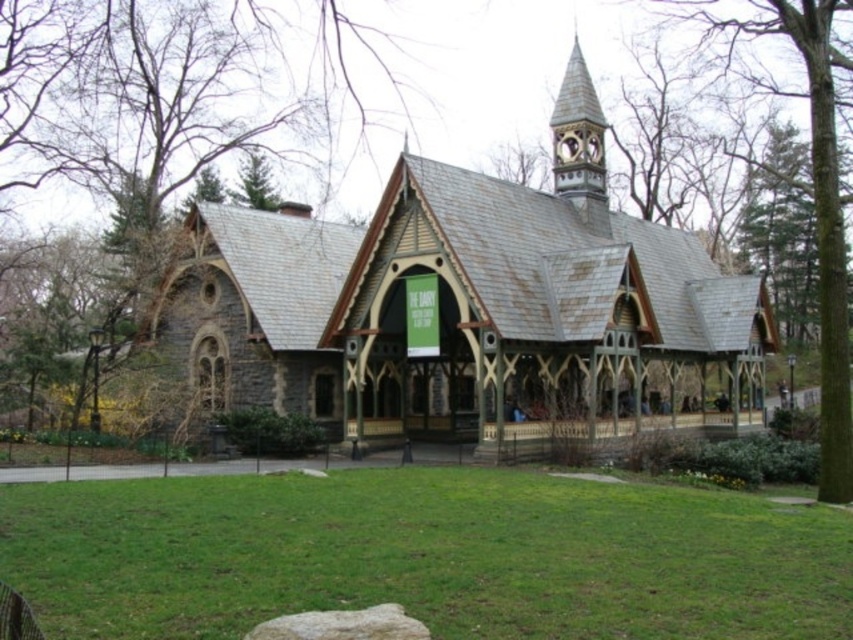
Question: Can you confirm if green grass at center is bigger than green leafy tree at upper left?

Choices:
 (A) no
 (B) yes

Answer: (A)

Question: Can you confirm if rusty metal church at center is positioned below green leafy tree at upper left?

Choices:
 (A) no
 (B) yes

Answer: (B)

Question: Which object is the closest to the green leafy tree at upper left?

Choices:
 (A) gray rough stone at lower center
 (B) green shingles roof at upper center
 (C) green grass at center

Answer: (C)

Question: Which of the following is the farthest from the observer?

Choices:
 (A) green leafy tree at upper left
 (B) rusty metal church at center
 (C) gray rough stone at lower center

Answer: (A)

Question: Is green shingles roof at upper center thinner than gray rough stone at lower center?

Choices:
 (A) no
 (B) yes

Answer: (A)

Question: Among these points, which one is farthest from the camera?

Choices:
 (A) (791, 33)
 (B) (560, 342)

Answer: (B)